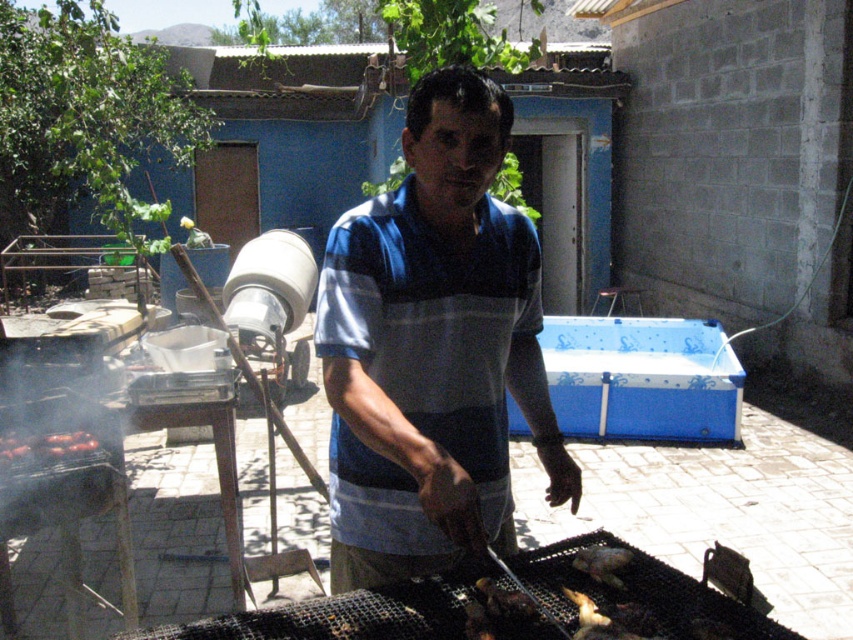
Question: Can you confirm if blue striped shirt at center is positioned to the left of charcoal grilled meat at center?

Choices:
 (A) yes
 (B) no

Answer: (A)

Question: Considering the real-world distances, which object is farthest from the charcoal grilled meat at center?

Choices:
 (A) smoked red meat at lower left
 (B) blue striped shirt at center

Answer: (A)

Question: Estimate the real-world distances between objects in this image. Which object is closer to the blue striped shirt at center?

Choices:
 (A) charcoal grilled meat at center
 (B) smoked red meat at lower left

Answer: (A)

Question: Does blue striped shirt at center have a lesser width compared to charcoal grilled meat at center?

Choices:
 (A) no
 (B) yes

Answer: (A)

Question: Which point is farther from the camera taking this photo?

Choices:
 (A) (596, 572)
 (B) (65, 452)
 (C) (460, 193)

Answer: (B)

Question: Can you confirm if blue striped shirt at center is positioned to the right of smoked red meat at lower left?

Choices:
 (A) yes
 (B) no

Answer: (A)